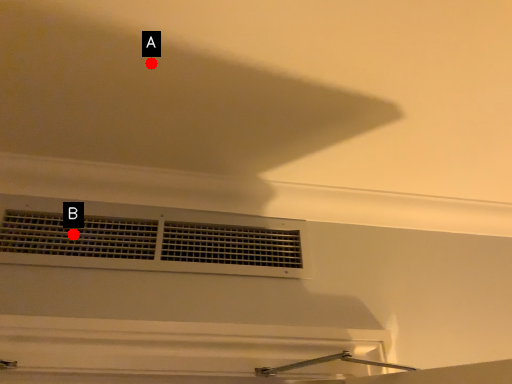
Question: Two points are circled on the image, labeled by A and B beside each circle. Which of the following is the closest to the observer?

Choices:
 (A) A is closer
 (B) B is closer

Answer: (A)